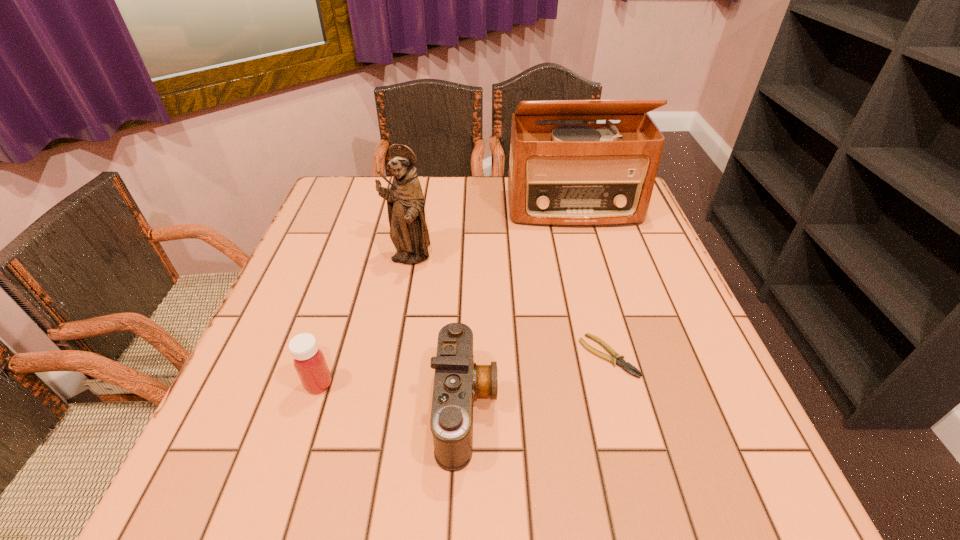
The height and width of the screenshot is (540, 960). I want to click on the farthest object, so click(595, 174).

Locate an element on the screen. The image size is (960, 540). the fourth nearest object is located at coordinates (405, 201).

Identify the location of figurine. (405, 201).

The width and height of the screenshot is (960, 540). In order to click on medicine in this screenshot , I will do `click(309, 361)`.

Identify the location of camera. (458, 380).

You are a GUI agent. You are given a task and a screenshot of the screen. Output one action in this format:
    pyautogui.click(x=<x>, y=<y>)
    Task: Click on the shortest object
    The height and width of the screenshot is (540, 960).
    Given the screenshot: What is the action you would take?
    pyautogui.click(x=617, y=359)

This screenshot has width=960, height=540. Identify the location of vacant space located on the front panel of the farthest object. (597, 290).

This screenshot has width=960, height=540. Identify the location of vacant space located 0.400m on the front-facing side of the figurine. (375, 438).

Locate an element on the screen. The width and height of the screenshot is (960, 540). blank area located on the left of the leftmost object is located at coordinates (266, 384).

The image size is (960, 540). I want to click on vacant space situated on the lens of the camera, so (589, 407).